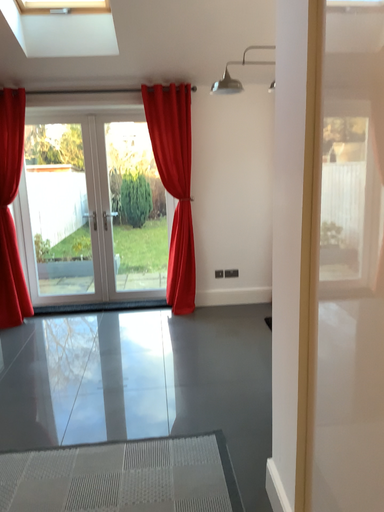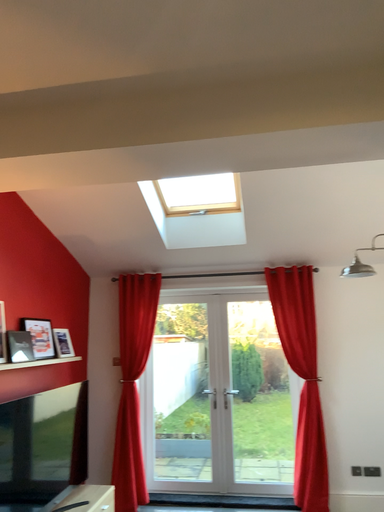
Question: Which way did the camera rotate in the video?

Choices:
 (A) rotated upward
 (B) rotated downward

Answer: (A)